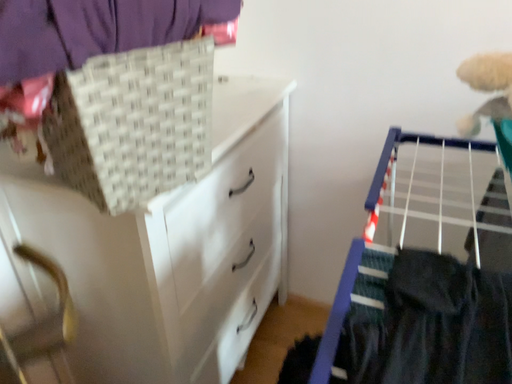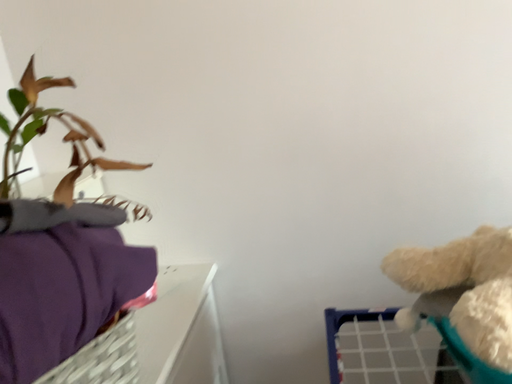
Question: How did the camera likely rotate when shooting the video?

Choices:
 (A) rotated right
 (B) rotated left

Answer: (A)